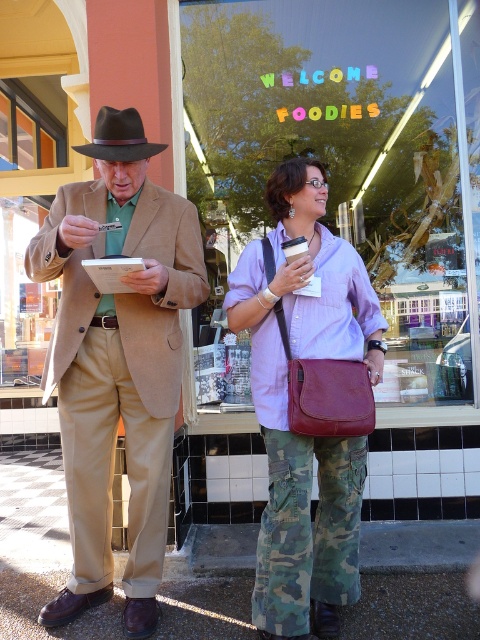
Question: Which of the following is the farthest from the observer?

Choices:
 (A) black felt fedora at upper left
 (B) matte glass window at center

Answer: (B)

Question: Does matte brown suit at center appear on the left side of black felt fedora at upper left?

Choices:
 (A) yes
 (B) no

Answer: (B)

Question: Which point appears closest to the camera in this image?

Choices:
 (A) (118, 122)
 (B) (109, 109)

Answer: (A)

Question: From the image, what is the correct spatial relationship of matte glass window at center in relation to matte purple shirt at center?

Choices:
 (A) right
 (B) left

Answer: (A)

Question: Considering the real-world distances, which object is closest to the black felt fedora at upper left?

Choices:
 (A) matte glass window at center
 (B) matte brown suit at center

Answer: (B)

Question: From the image, what is the correct spatial relationship of matte glass window at center in relation to black felt fedora at upper left?

Choices:
 (A) above
 (B) below

Answer: (B)